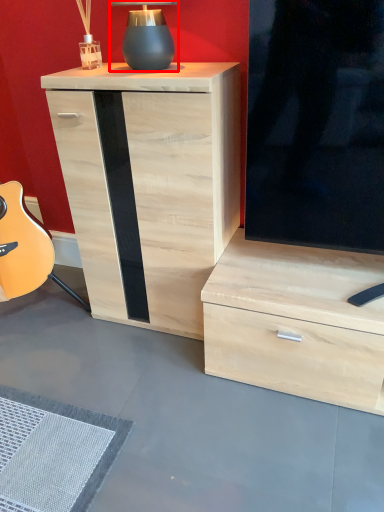
Question: From the image's perspective, considering the relative positions of table lamp (annotated by the red box) and chest of drawers in the image provided, where is table lamp (annotated by the red box) located with respect to the staircase?

Choices:
 (A) below
 (B) above

Answer: (B)